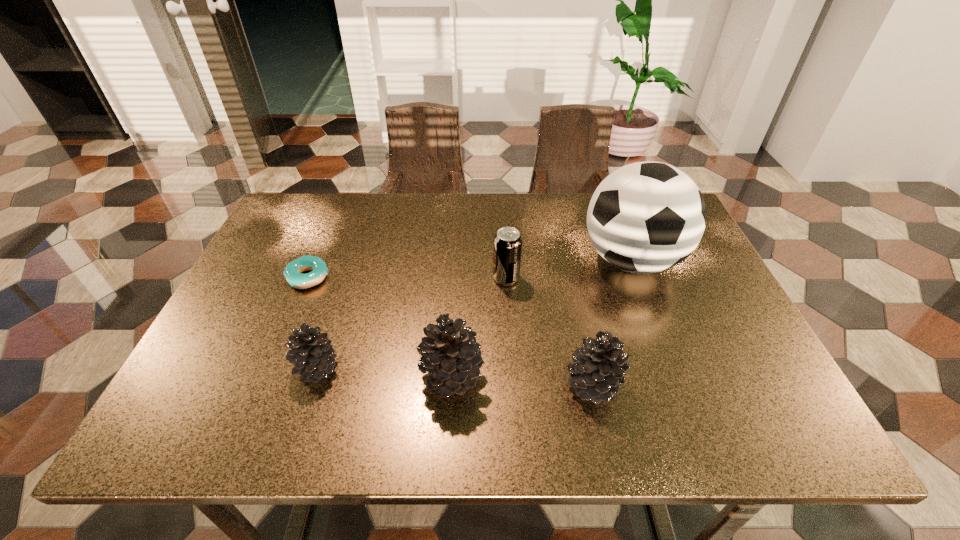
Given the evenly spaced pinecones in the image, where should an extra pinecone be added on the right to preserve the spacing? Please point to a vacant space. Please provide its 2D coordinates. Your answer should be formatted as a tuple, i.e. [(x, y)], where the tuple contains the x and y coordinates of a point satisfying the conditions above.

[(737, 393)]